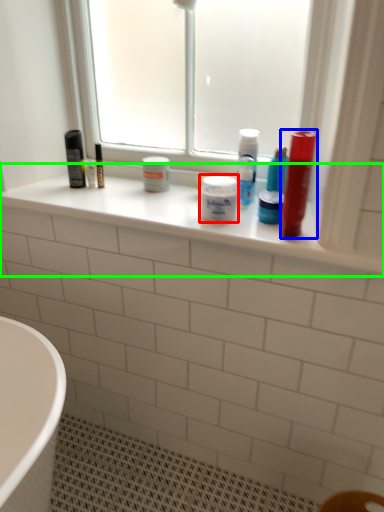
Question: Which is nearer to the toiletry (highlighted by a red box)? mouthwash (highlighted by a blue box) or window sill (highlighted by a green box).

Choices:
 (A) mouthwash
 (B) window sill

Answer: (A)